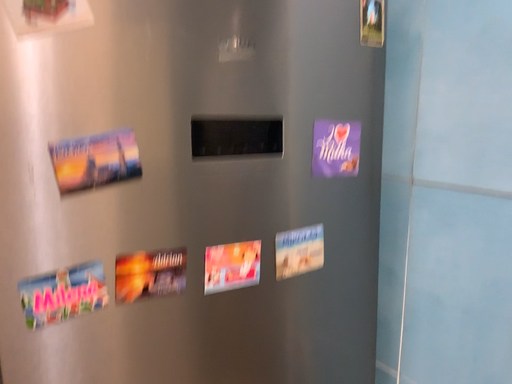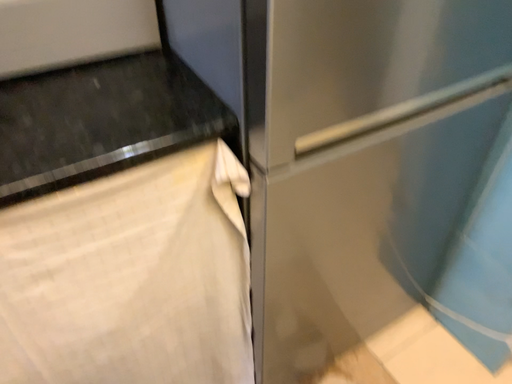
Question: Which way did the camera rotate in the video?

Choices:
 (A) rotated upward
 (B) rotated downward

Answer: (B)